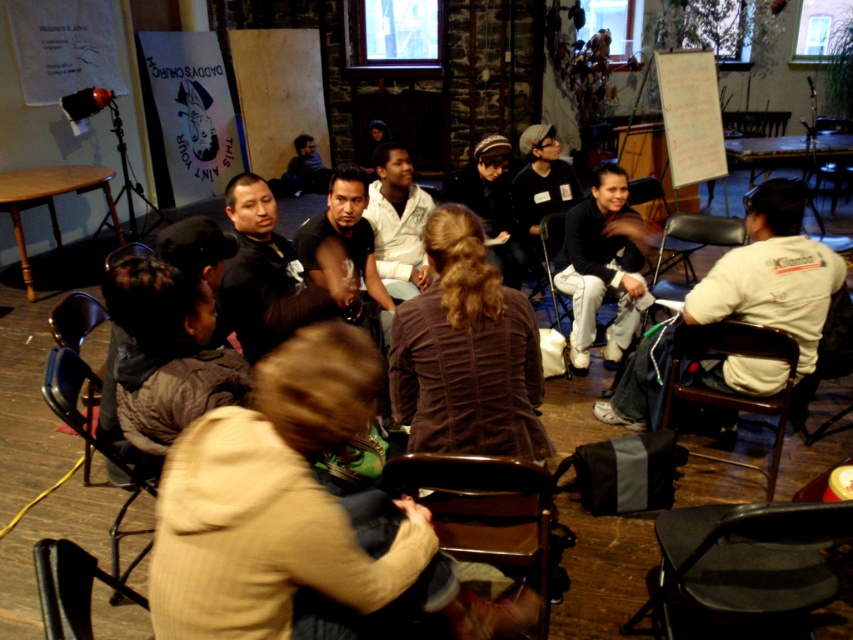
You are a photographer trying to capture a candid shot of the dark brown leather jacket at center and the dark brown leather chair at lower left. Since the jacket is above the chair, where should you position your camera relative to the chair to ensure both are in frame?

The dark brown leather jacket at center is above the dark brown leather chair at lower left. To capture both in the frame, position the camera above the chair so the jacket is visible above it.

You are standing in the room and want to move from the point at coordinates point (428, 504) to the point at coordinates point (73, 417). Which direction should you move to get closer to your destination?

To move from point (428, 504) to point (73, 417), you should move downward and to the left since point (73, 417) is located below and to the left of point (428, 504) in the image.